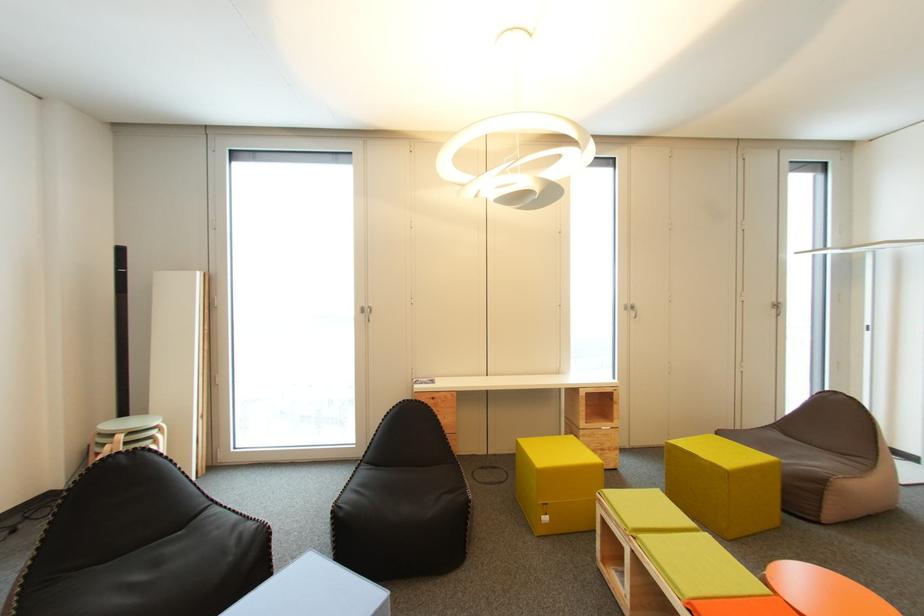
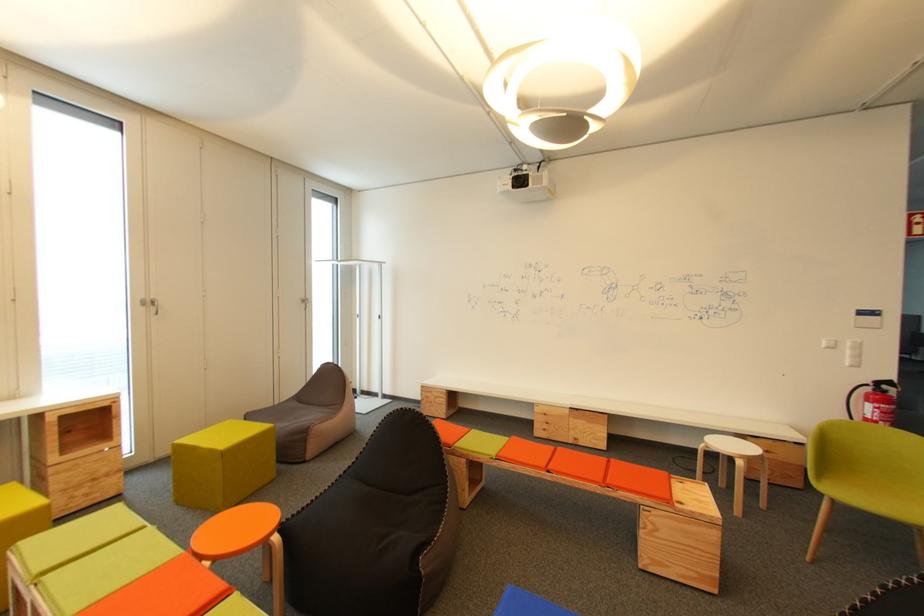
Question: The camera is either moving clockwise (left) or counter-clockwise (right) around the object. The first image is from the beginning of the video and the second image is from the end. Is the camera moving left or right when shooting the video?

Choices:
 (A) Left
 (B) Right

Answer: (A)